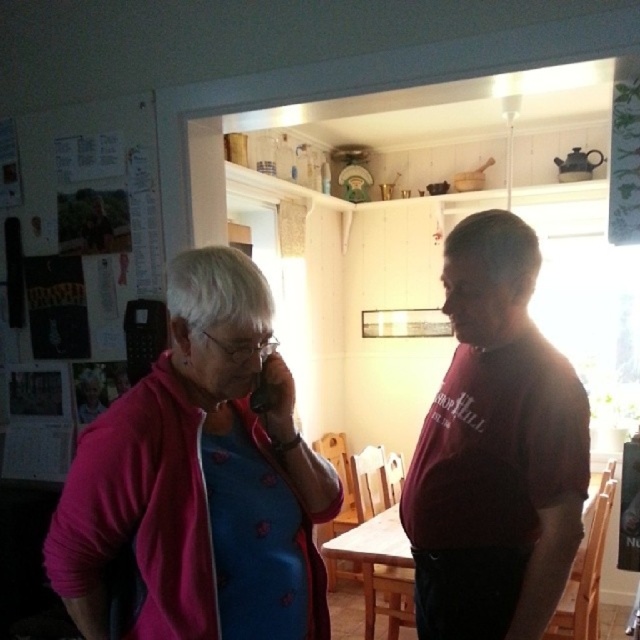
You are a fashion designer observing the two individuals in the kitchen. You need to determine which clothing item is positioned higher on their bodies. Which one is higher between the pink fabric jacket at center and the maroon cotton shirt at center?

The pink fabric jacket at center is positioned above the maroon cotton shirt at center, so it is higher on the body.

You are a fashion designer observing two people in a kitchen. You notice the pink fabric at left and the pink fabric jacket at center. Which pink fabric item is located more to the left?

The pink fabric at left is more to the left than the pink fabric jacket at center.

You are standing in a kitchen and see the pink fabric at left. Can you reach out and touch it with your hand?

The pink fabric at left is 3.43 feet away from you, so you cannot reach it with your hand since the average human arm length is about 2.5 feet.